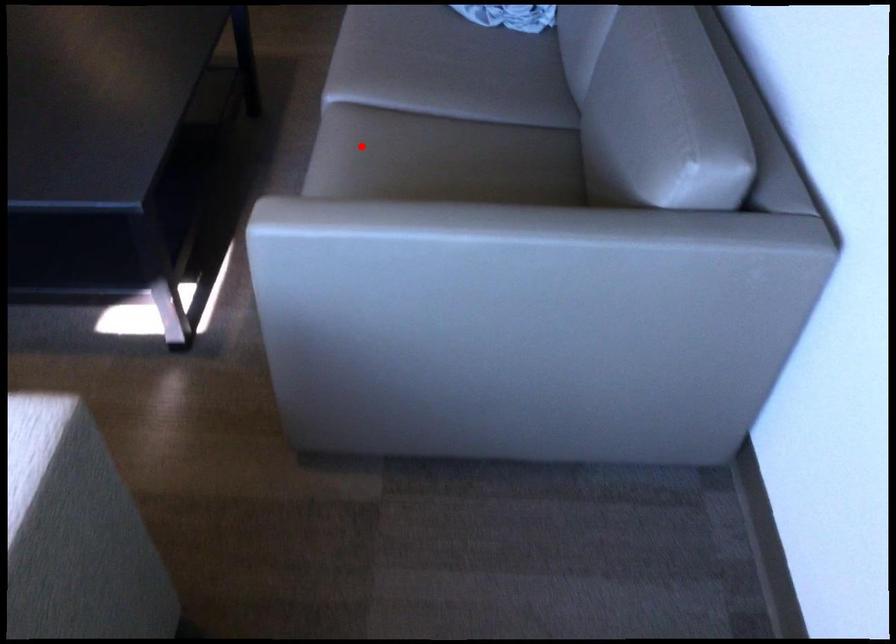
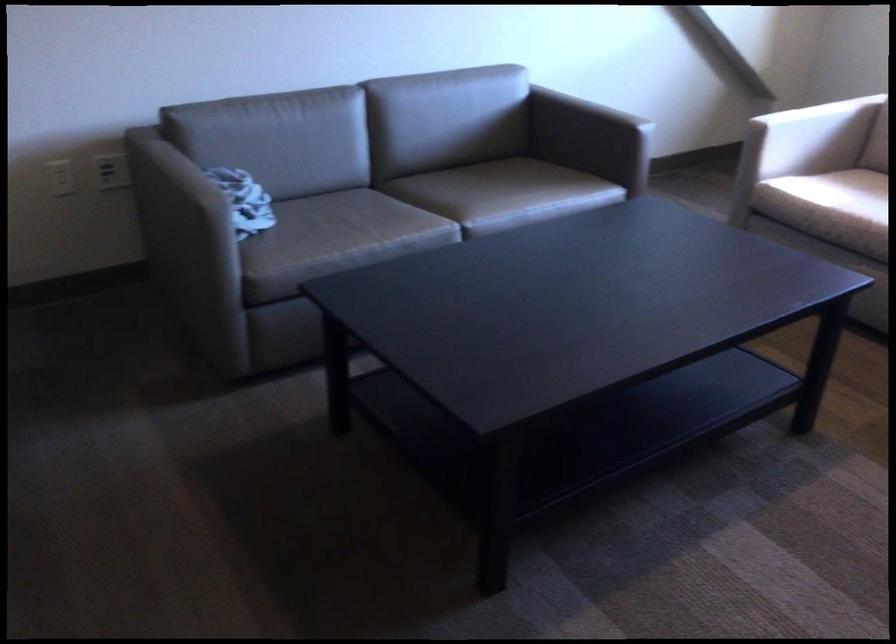
Find the pixel in the second image that matches the highlighted location in the first image.

(489, 194)